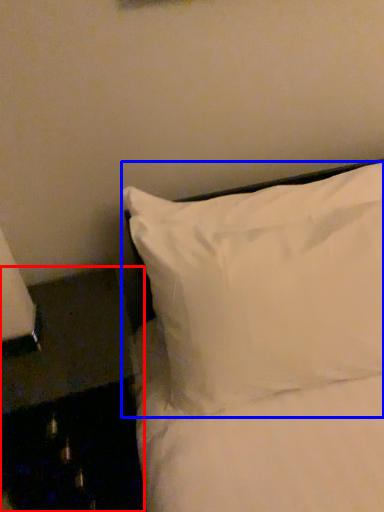
Question: Which object appears farthest to the camera in this image, furniture (highlighted by a red box) or pillow (highlighted by a blue box)?

Choices:
 (A) furniture
 (B) pillow

Answer: (A)